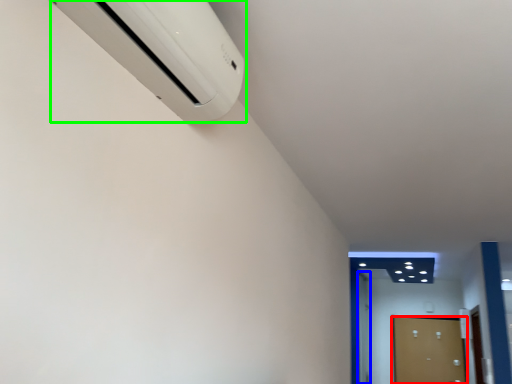
Question: Considering the real-world distances, which object is farthest from door (highlighted by a red box)? door (highlighted by a blue box) or home appliance (highlighted by a green box)?

Choices:
 (A) door
 (B) home appliance

Answer: (B)